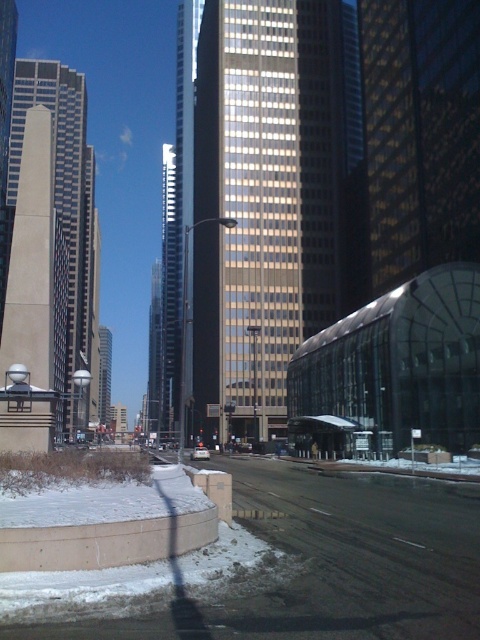
Can you confirm if gold reflective glass skyscraper at center is thinner than beige glass skyscraper at left?

Indeed, gold reflective glass skyscraper at center has a lesser width compared to beige glass skyscraper at left.

Is gold reflective glass skyscraper at center above beige glass skyscraper at left?

Yes, gold reflective glass skyscraper at center is above beige glass skyscraper at left.

Between point (237, 200) and point (69, 186), which one is positioned behind?

The point (69, 186) is more distant.

Identify the location of gold reflective glass skyscraper at center. (272, 200).